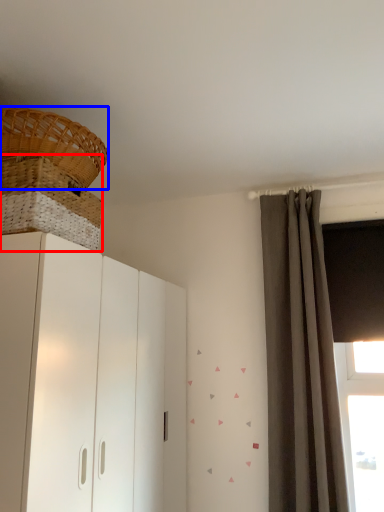
Question: Among these objects, which one is farthest to the camera, basket (highlighted by a red box) or basket (highlighted by a blue box)?

Choices:
 (A) basket
 (B) basket

Answer: (B)